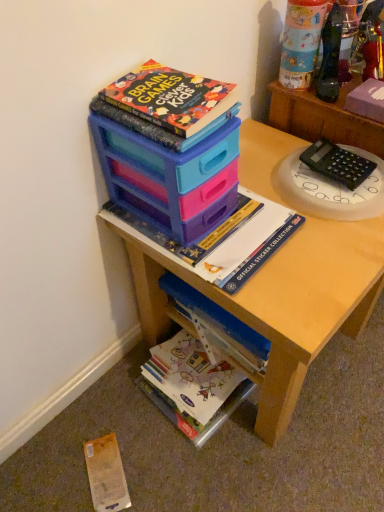
Find the location of a particular element. The width and height of the screenshot is (384, 512). free space to the back side of yellow paper at lower left is located at coordinates (108, 409).